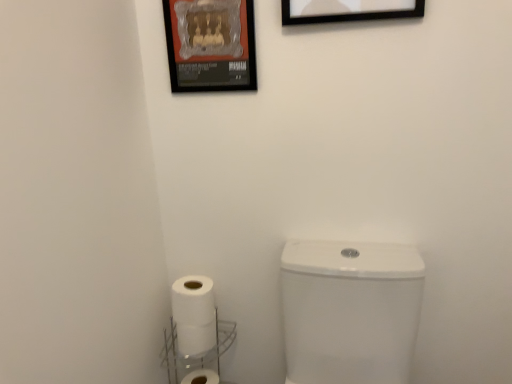
Question: In the image, is white glossy toilet at lower right positioned in front of or behind black matte picture frame at upper center, which appears as the 1th picture frame when viewed from the right?

Choices:
 (A) behind
 (B) front

Answer: (B)

Question: Is white glossy toilet at lower right taller or shorter than black matte picture frame at upper center, which is the second picture frame in left-to-right order?

Choices:
 (A) tall
 (B) short

Answer: (A)

Question: Based on their relative distances, which object is farther from the white glossy toilet at lower right?

Choices:
 (A) black matte picture frame at upper center, positioned as the first picture frame in front-to-back order
 (B) white plastic shelf at lower center
 (C) white matte toilet paper at lower left, the first toilet paper ordered from the bottom
 (D) white matte toilet paper at lower left, marked as the second toilet paper in a bottom-to-top arrangement
 (E) metallic poster at upper center, acting as the first picture frame starting from the left

Answer: (A)

Question: Which object is positioned farthest from the white plastic shelf at lower center?

Choices:
 (A) metallic poster at upper center, the 2th picture frame from the front
 (B) white glossy toilet at lower right
 (C) black matte picture frame at upper center, the second picture frame when ordered from back to front
 (D) white matte toilet paper at lower left, marked as the second toilet paper in a bottom-to-top arrangement
 (E) white matte toilet paper at lower left, the 2th toilet paper positioned from the top

Answer: (C)